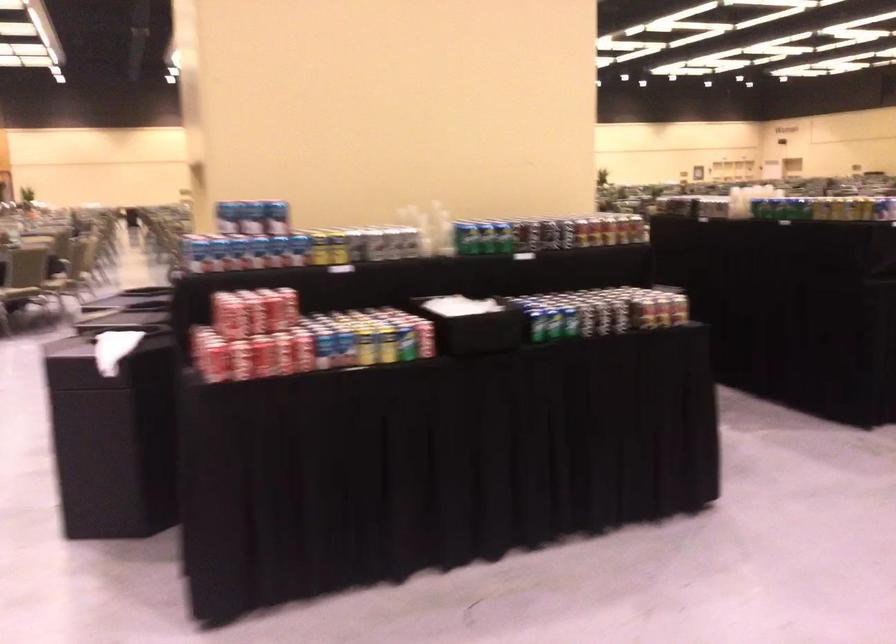
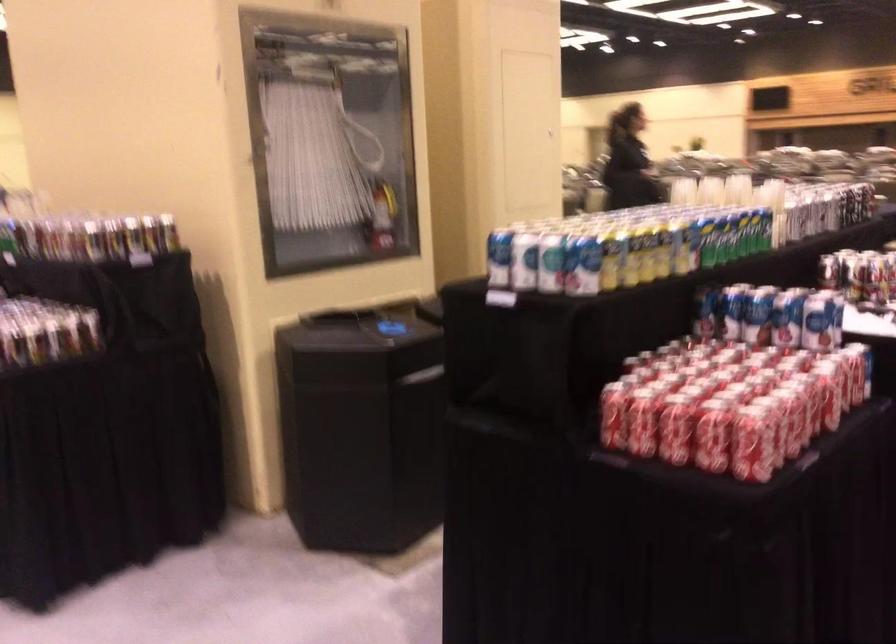
Question: I am providing you with two images of the same scene from different viewpoints. Please identify which objects are invisible in image2.

Choices:
 (A) yellow soda can
 (B) clear plastic cup
 (C) fire hose nozzle
 (D) green handled mop

Answer: (A)